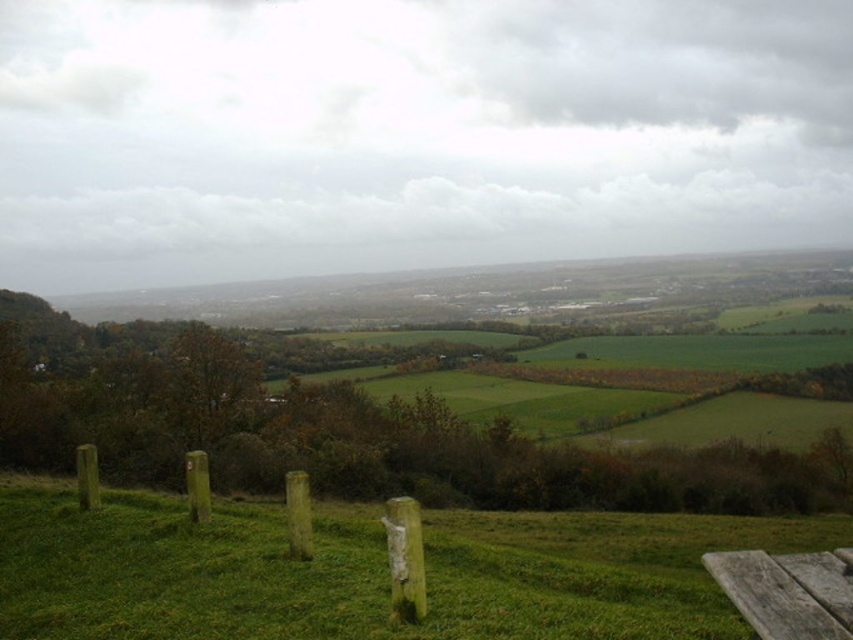
You are a gardener who wants to mow the green grassy at lower center. However, there is a weathered wood fence at lower center in the way. Can you mow the grass without hitting the fence?

The green grassy at lower center is taller than the weathered wood fence at lower center, so yes, you can mow the grass without hitting the fence since the grass is higher than the fence.

You are a landscape architect planning to install a new pathway between the green grassy at lower center and the weathered wood bench at lower right. The pathway must be exactly 20 meters long. Can you fit the pathway between them without exceeding the required length?

The distance between the green grassy at lower center and the weathered wood bench at lower right is 21.04 meters. Since the required pathway length is 20 meters, the pathway cannot be installed without exceeding the required length.

You are standing at the origin point in the image and want to walk towards the point labeled point (404, 612). Will the point labeled point (660, 538) block your path?

Point (660, 538) is behind point (404, 612), so it will not block your path to point (404, 612).